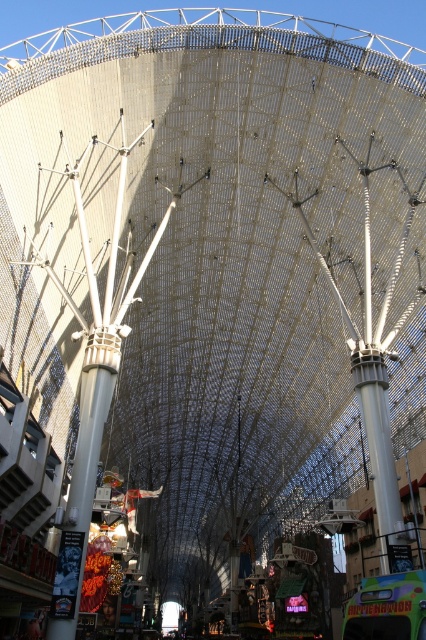
You are standing in the shopping mall and want to determine the relative positions of two points marked in the image. Which point is closer to you, point 1 at coordinates point 1 at coordinates point (86, 355) or point 2 at coordinates point (371, 394)?

Point (86, 355) is closer to you because it is further to the viewer than point (371, 394).

You are an architect visiting the mall and want to compare the two pillars in the center. Which one is taller between the white metallic pillar at center and the white glossy pillar at center?

The white metallic pillar at center is taller than the white glossy pillar at center.